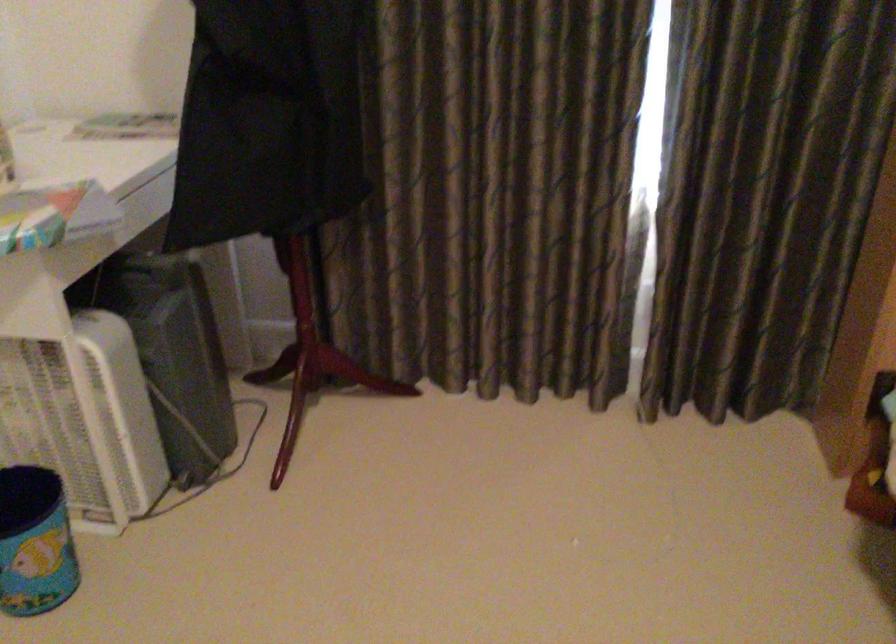
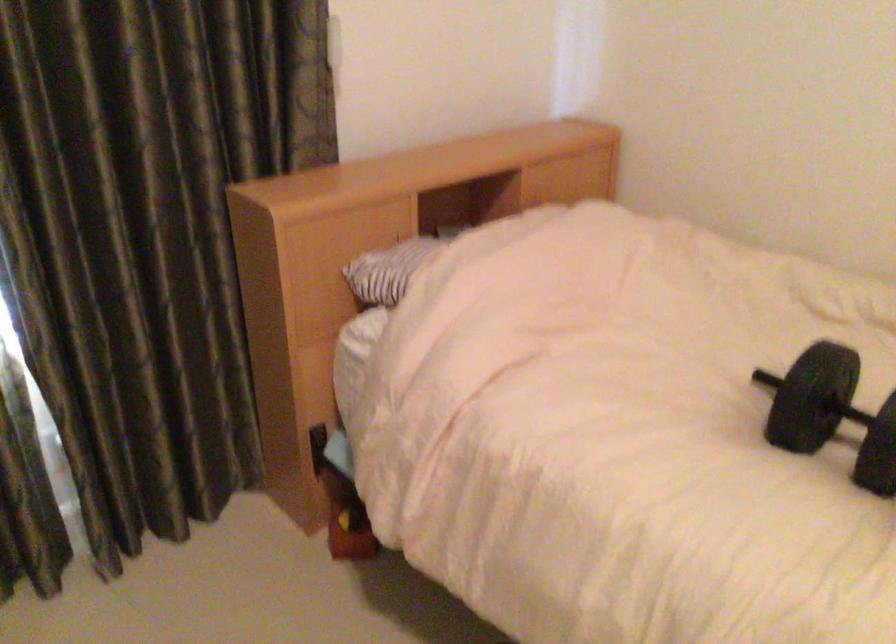
Question: How did the camera likely rotate?

Choices:
 (A) Left
 (B) Right
 (C) Up
 (D) Down

Answer: (B)